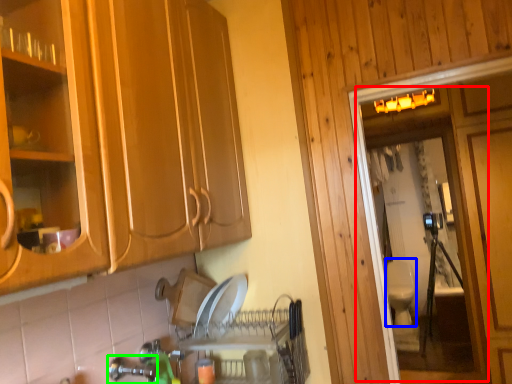
Question: Based on their relative distances, which object is nearer to screen door (highlighted by a red box)? Choose from toilet bowl (highlighted by a blue box) and faucet (highlighted by a green box).

Choices:
 (A) toilet bowl
 (B) faucet

Answer: (A)